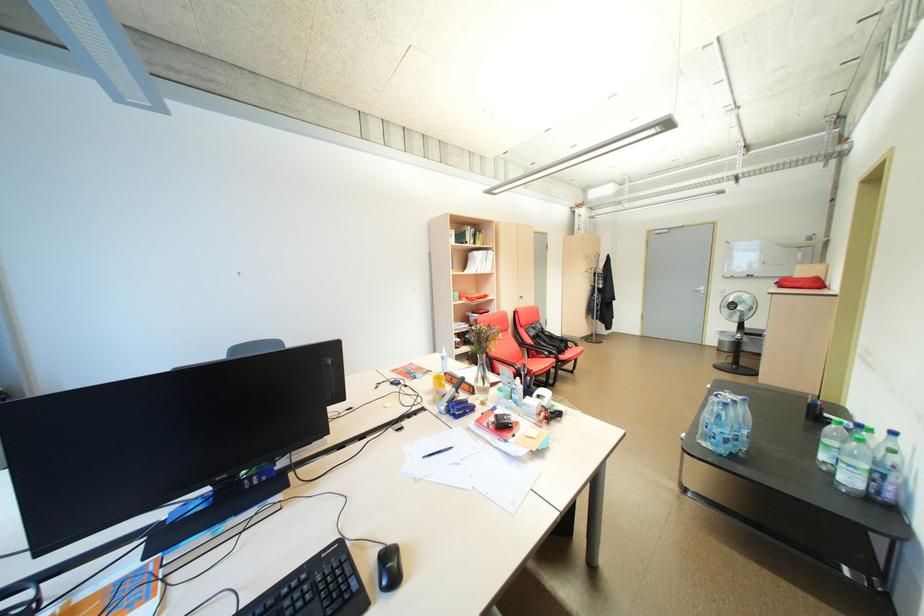
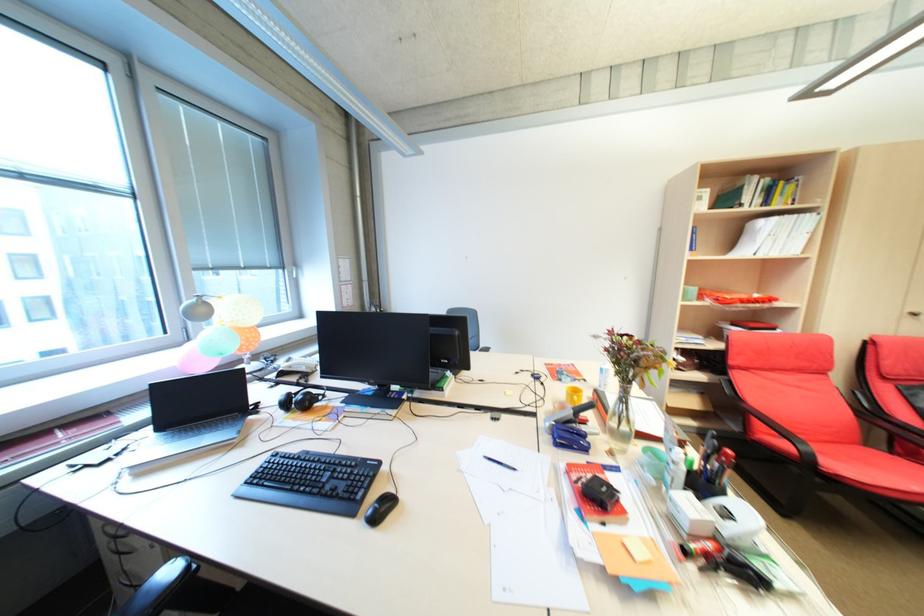
Find the pixel in the second image that matches point 489,264 in the first image.

(784, 240)